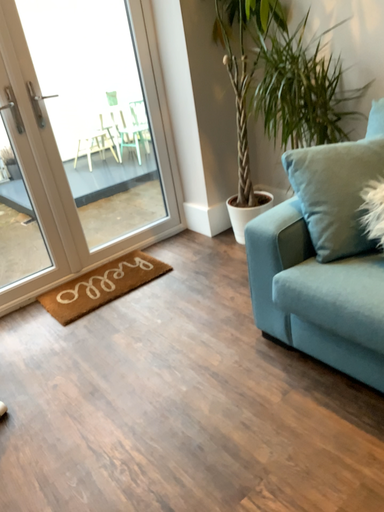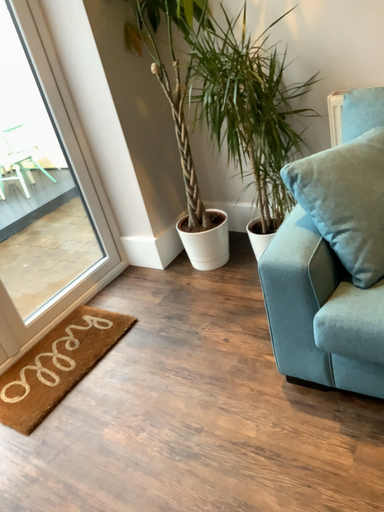
Question: Which way did the camera rotate in the video?

Choices:
 (A) rotated left
 (B) rotated right

Answer: (B)